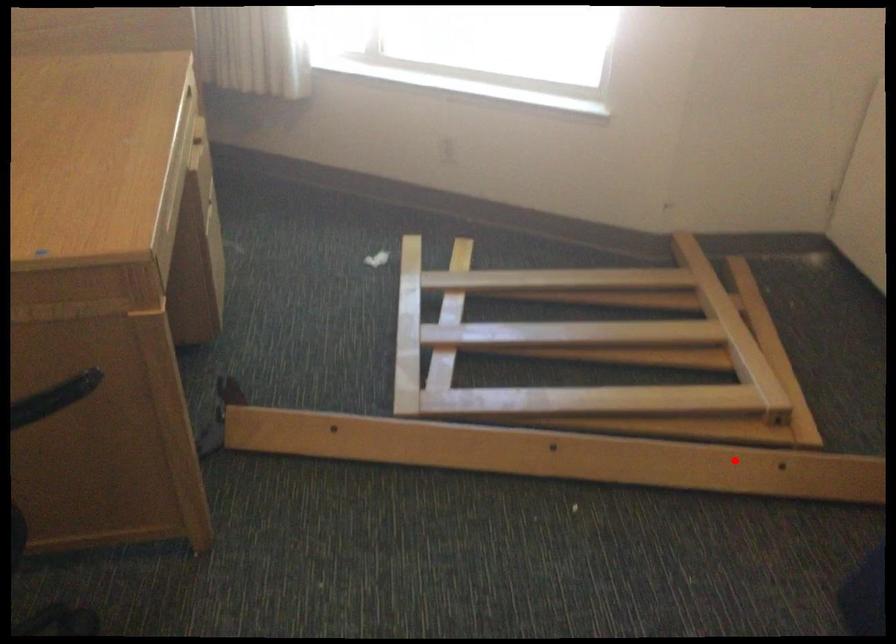
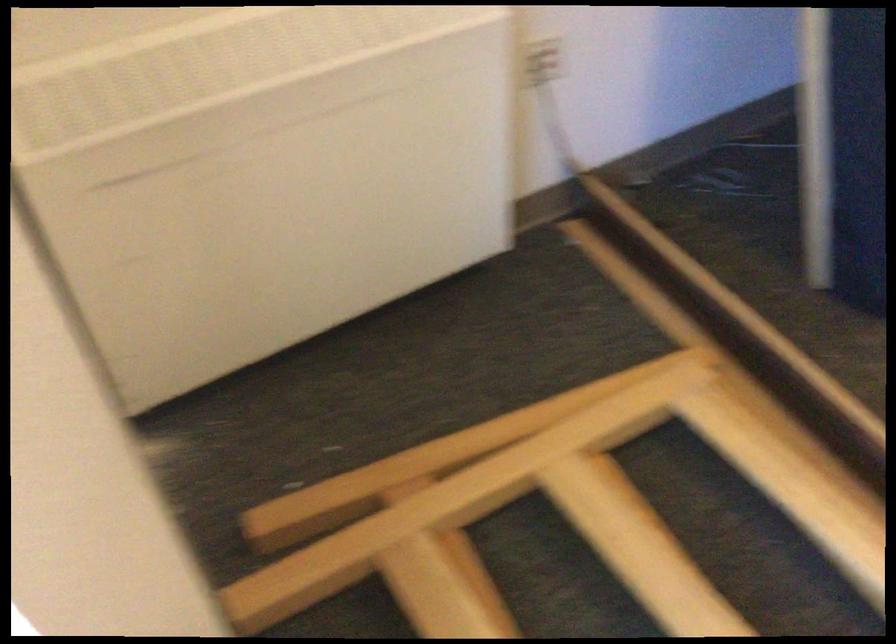
Question: I am providing you with two images of the same scene from different viewpoints. In image1, a red point is highlighted. Considering the same 3D point in image2, which of the following is correct?

Choices:
 (A) It is closer
 (B) It is farther

Answer: (A)